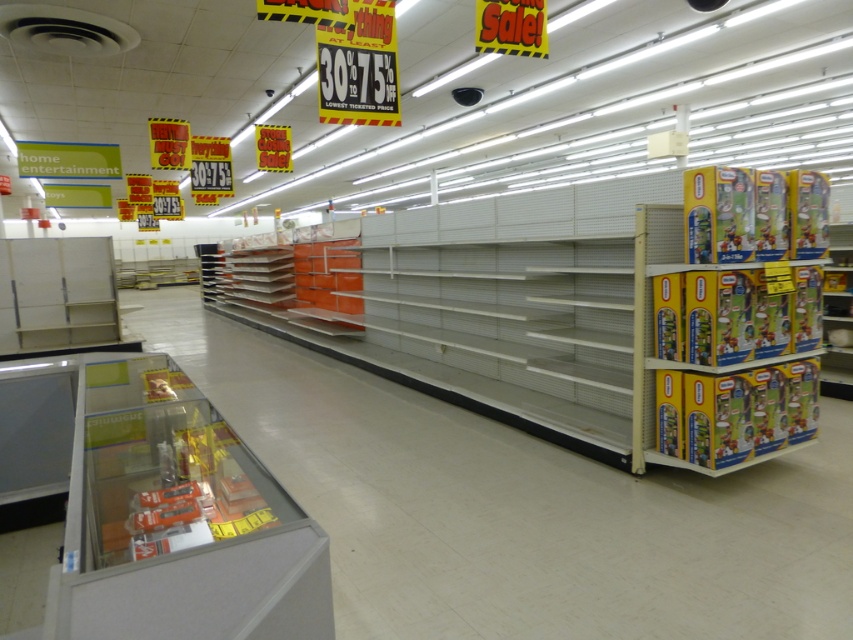
Does point (294, 540) lie in front of point (724, 429)?

Yes, it is.

Who is taller, clear plastic display case at lower left or yellow cardboard boxes at right?

yellow cardboard boxes at right is taller.

Does point (51, 604) lie behind point (679, 442)?

That is False.

I want to click on clear plastic display case at lower left, so click(178, 522).

Image resolution: width=853 pixels, height=640 pixels. Identify the location of yellow cardboard toy at right. (740, 266).

Can you confirm if clear plastic display case at lower left is positioned above yellow cardboard toy at right?

Incorrect, clear plastic display case at lower left is not positioned above yellow cardboard toy at right.

Which is below, clear plastic display case at lower left or yellow cardboard toy at right?

clear plastic display case at lower left

Between point (218, 541) and point (759, 208), which one is positioned in front?

Point (218, 541)

Locate an element on the screen. The width and height of the screenshot is (853, 640). clear plastic display case at lower left is located at coordinates point(178,522).